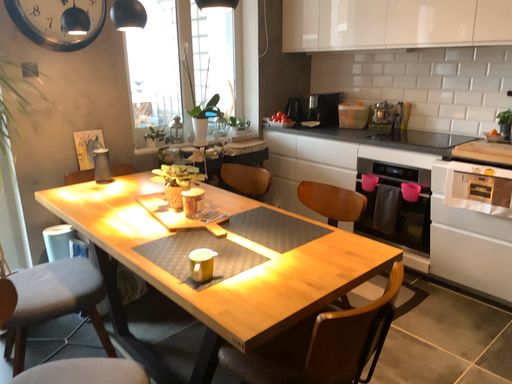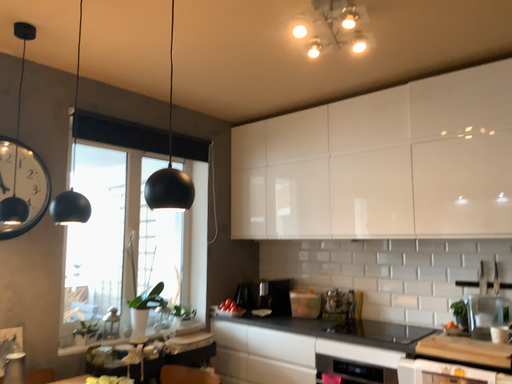
Question: Which way did the camera rotate in the video?

Choices:
 (A) rotated right
 (B) rotated left

Answer: (A)